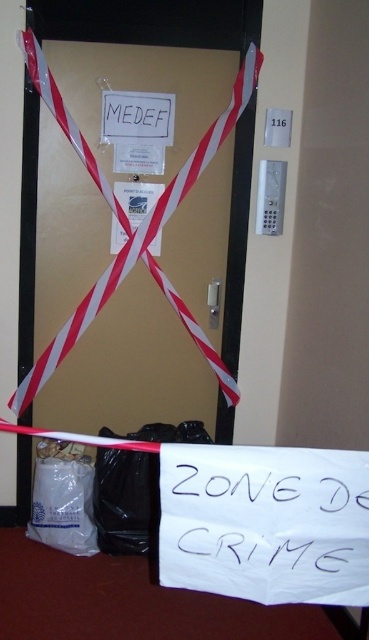
You are organizing items in a room and see the white plastic bag at lower left and the white paper at center. Which item should you choose if you need a larger container to hold more items?

The white plastic bag at lower left is bigger than the white paper at center, so you should choose the white plastic bag at lower left.